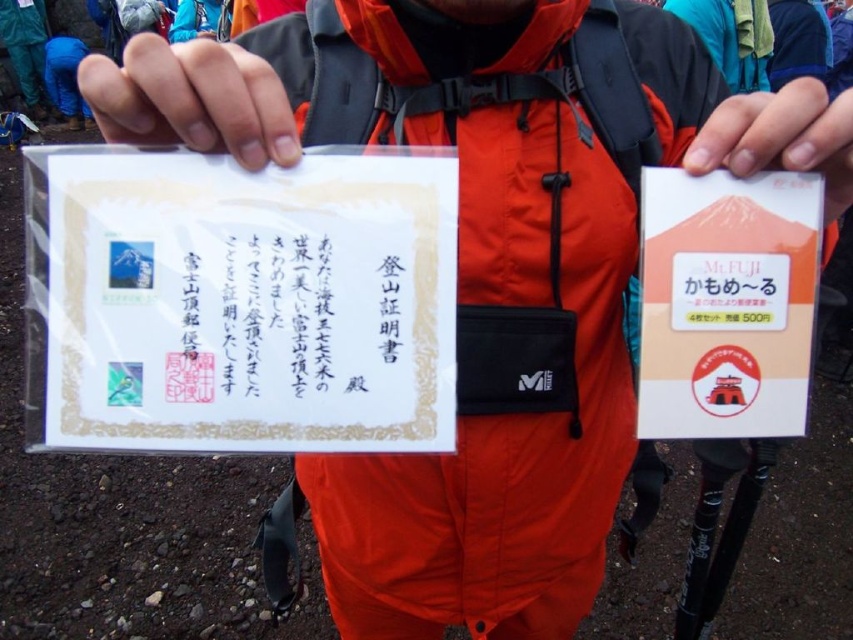
Question: Can you confirm if matte white paper at upper center is positioned to the right of matte plastic card at center?

Choices:
 (A) no
 (B) yes

Answer: (A)

Question: From the image, what is the correct spatial relationship of matte white paper at upper center in relation to matte plastic card at center?

Choices:
 (A) above
 (B) below

Answer: (A)

Question: Which is nearer to the matte white paper at upper center?

Choices:
 (A) white paper at center
 (B) matte plastic card at center

Answer: (A)

Question: Which of the following is the farthest from the observer?

Choices:
 (A) white paper at center
 (B) matte white paper at upper center
 (C) matte plastic card at center

Answer: (A)

Question: Can you confirm if matte white paper at upper center is wider than matte plastic card at center?

Choices:
 (A) no
 (B) yes

Answer: (B)

Question: Estimate the real-world distances between objects in this image. Which object is farther from the matte white paper at upper center?

Choices:
 (A) white paper at center
 (B) matte plastic card at center

Answer: (B)